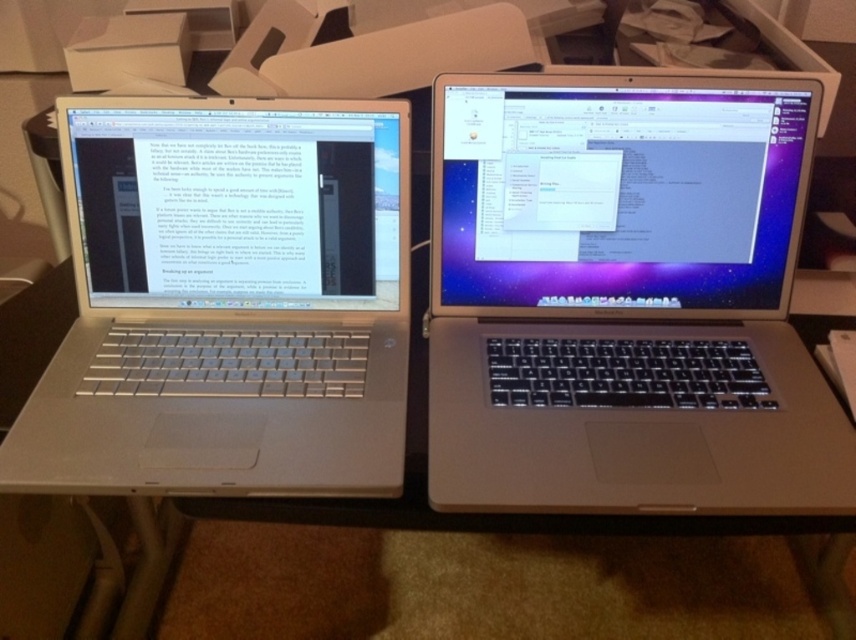
Looking at this image, you are a delivery person who needs to place a 28 inch box on the desk where the silver metallic laptop at left is located. Can you place the box without moving the laptop?

The silver metallic laptop at left and viewer are 28.59 inches apart, so the 28 inch box can be placed on the desk as there is enough space between the laptop and the viewer.

You are a person with a height of 1.7 meters standing in front of the desk. You want to pick up the satin silver laptop at center. Can you comfortably reach it without needing to stretch too far?

The satin silver laptop at center is 72.22 centimeters away from the viewer. Since the average comfortable reaching distance for a person of 1.7 meters is approximately 70 to 80 centimeters, the distance is within a comfortable range. Therefore, you can comfortably reach the satin silver laptop at center without excessive stretching.